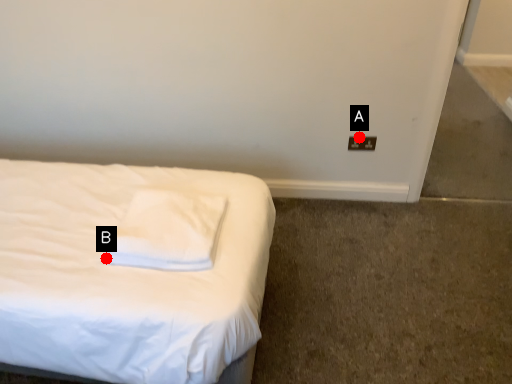
Question: Two points are circled on the image, labeled by A and B beside each circle. Which point appears closest to the camera in this image?

Choices:
 (A) A is closer
 (B) B is closer

Answer: (B)